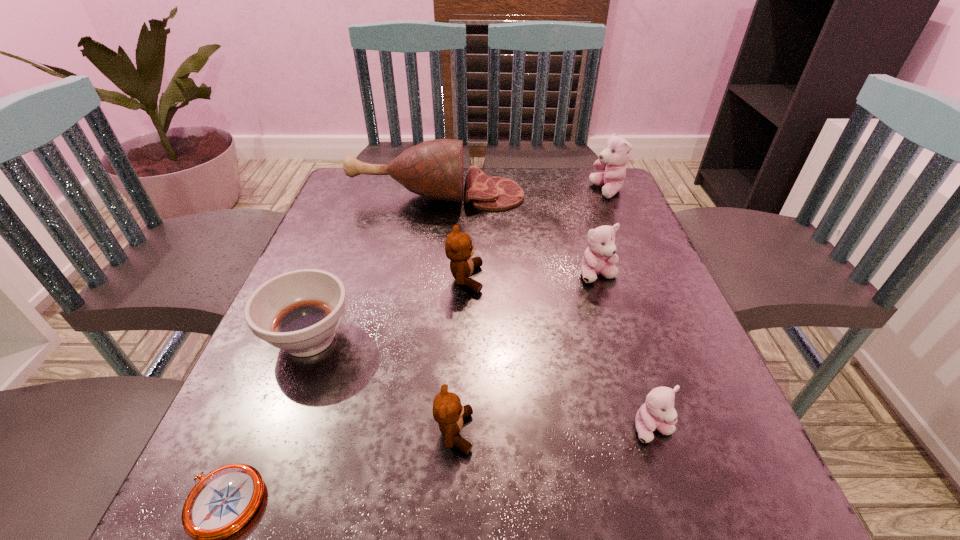
You are a GUI agent. You are given a task and a screenshot of the screen. Output one action in this format:
    pyautogui.click(x=<x>, y=<y>)
    Task: Click on the free space between the ham and the smallest pink teddy bear
    This screenshot has height=540, width=960.
    Given the screenshot: What is the action you would take?
    pyautogui.click(x=545, y=312)

Find the location of a particular element. The height and width of the screenshot is (540, 960). free space between the second nearest pink teddy bear and the smallest pink teddy bear is located at coordinates (626, 352).

This screenshot has width=960, height=540. Find the location of `free space between the bigger brown teddy bear and the fourth nearest object`. free space between the bigger brown teddy bear and the fourth nearest object is located at coordinates (388, 308).

This screenshot has height=540, width=960. Find the location of `free spot between the biggest pink teddy bear and the smaller brown teddy bear`. free spot between the biggest pink teddy bear and the smaller brown teddy bear is located at coordinates (531, 312).

Identify the location of unoccupied area between the ham and the soup bowl. (373, 266).

Point out which object is positioned as the fifth nearest to the farthest teddy bear. Please provide its 2D coordinates. Your answer should be formatted as a tuple, i.e. [(x, y)], where the tuple contains the x and y coordinates of a point satisfying the conditions above.

[(299, 311)]

Locate which object is the seventh closest to the bigger brown teddy bear. Please provide its 2D coordinates. Your answer should be formatted as a tuple, i.e. [(x, y)], where the tuple contains the x and y coordinates of a point satisfying the conditions above.

[(222, 502)]

Locate an element on the screen. the fifth closest teddy bear relative to the ham is located at coordinates (658, 412).

Identify which teddy bear is located as the second nearest to the fifth farthest object. Please provide its 2D coordinates. Your answer should be formatted as a tuple, i.e. [(x, y)], where the tuple contains the x and y coordinates of a point satisfying the conditions above.

[(448, 412)]

The image size is (960, 540). Find the location of `pink teddy bear that stands as the closest to the shortest object`. pink teddy bear that stands as the closest to the shortest object is located at coordinates (658, 412).